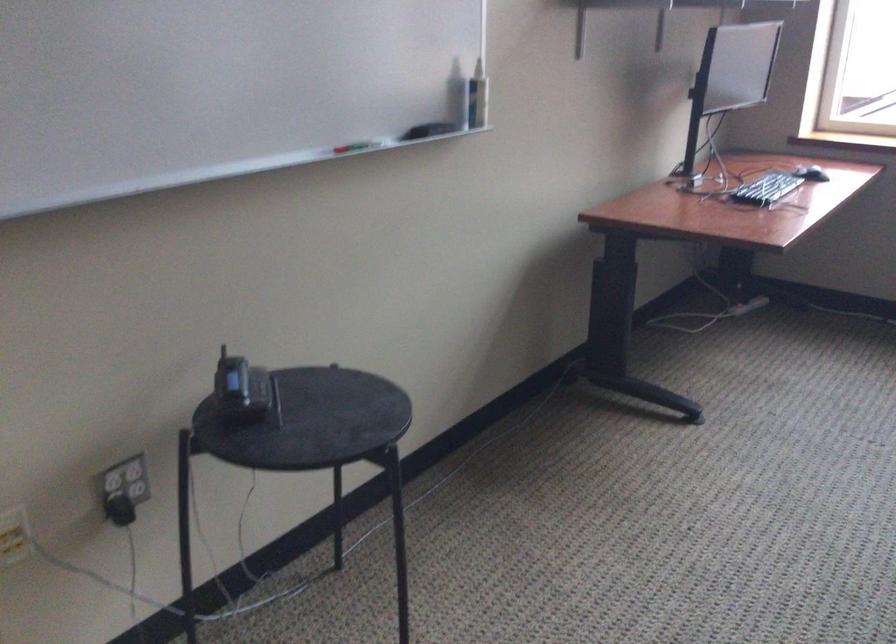
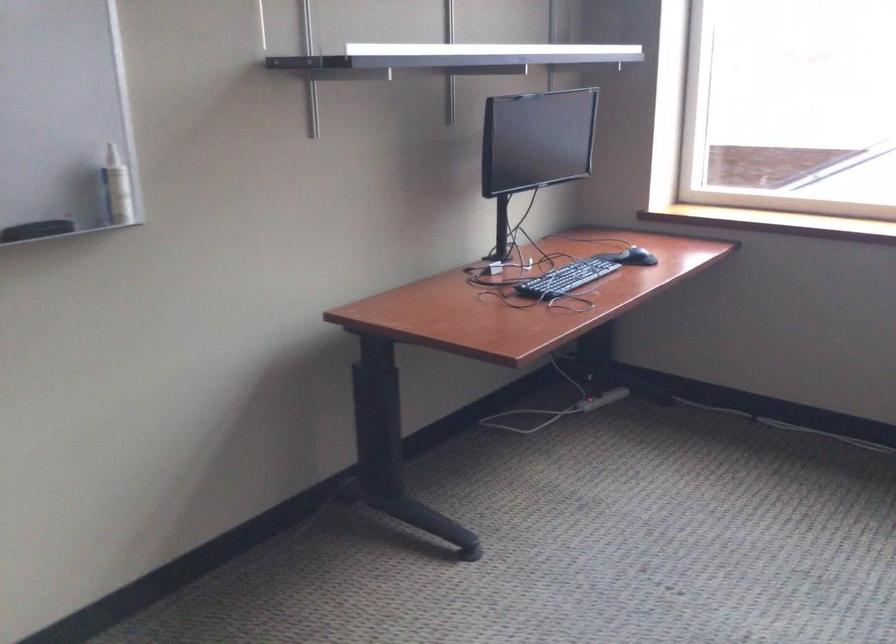
Question: The first image is from the beginning of the video and the second image is from the end. How did the camera likely rotate when shooting the video?

Choices:
 (A) Left
 (B) Right
 (C) Up
 (D) Down

Answer: (C)